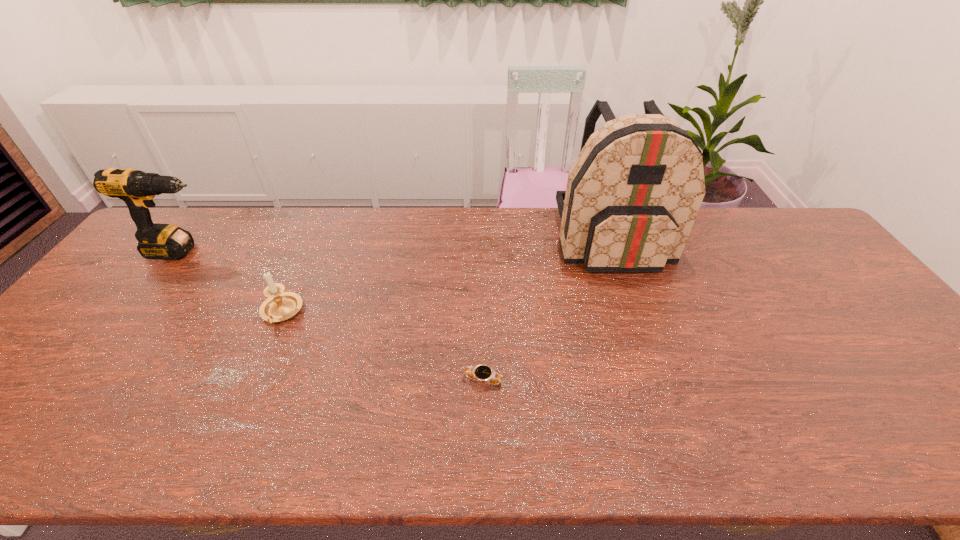
Select which object is the second closest to the drill. Please provide its 2D coordinates. Your answer should be formatted as a tuple, i.e. [(x, y)], where the tuple contains the x and y coordinates of a point satisfying the conditions above.

[(484, 373)]

I want to click on free space that satisfies the following two spatial constraints: 1. at the tip of the drill; 2. on the right side of the shortest object, so click(x=84, y=380).

You are a GUI agent. You are given a task and a screenshot of the screen. Output one action in this format:
    pyautogui.click(x=<x>, y=<y>)
    Task: Click on the vacant area that satisfies the following two spatial constraints: 1. with a handle on the side of the third object from right to left; 2. on the right side of the shortest object
    The width and height of the screenshot is (960, 540).
    Given the screenshot: What is the action you would take?
    pyautogui.click(x=252, y=380)

At what (x,y) coordinates should I click in order to perform the action: click on vacant point that satisfies the following two spatial constraints: 1. with a handle on the side of the third tallest object; 2. on the right side of the watch. Please return your answer as a coordinate pair (x, y). Looking at the image, I should click on (252, 380).

You are a GUI agent. You are given a task and a screenshot of the screen. Output one action in this format:
    pyautogui.click(x=<x>, y=<y>)
    Task: Click on the free space in the image that satisfies the following two spatial constraints: 1. with a handle on the side of the shortest object; 2. on the right side of the third tallest object
    This screenshot has width=960, height=540.
    Given the screenshot: What is the action you would take?
    pyautogui.click(x=252, y=380)